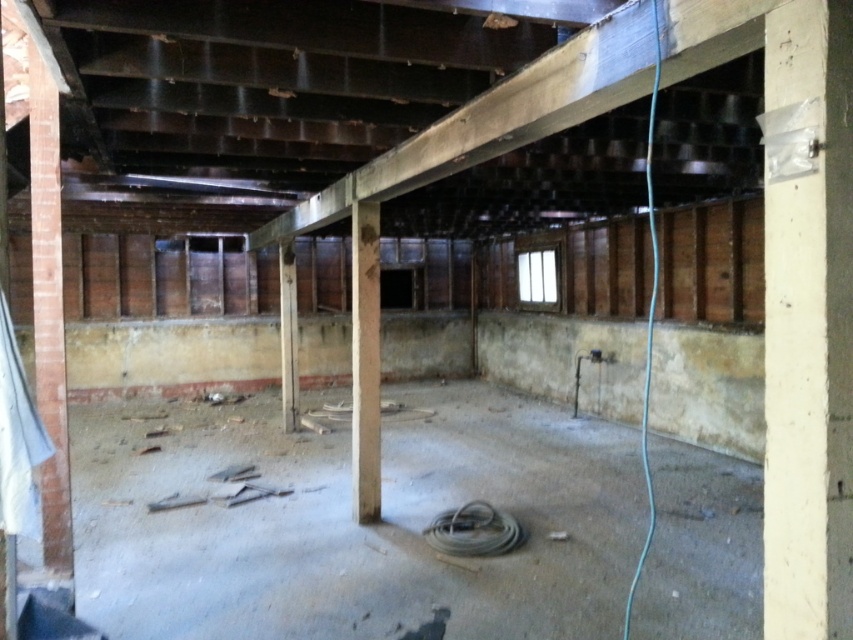
Question: Does white painted wood pillar at right appear on the left side of dark brown wooden beam at upper center?

Choices:
 (A) no
 (B) yes

Answer: (A)

Question: Which object appears farthest from the camera in this image?

Choices:
 (A) white painted wood pillar at right
 (B) dark brown wooden beam at upper center
 (C) concrete/rough pillar at center

Answer: (C)

Question: Is dark brown wooden beam at upper center to the left of concrete/rough pillar at center from the viewer's perspective?

Choices:
 (A) yes
 (B) no

Answer: (B)

Question: Does white painted wood pillar at right lie in front of concrete/rough pillar at center?

Choices:
 (A) no
 (B) yes

Answer: (B)

Question: Which point is closer to the camera?

Choices:
 (A) (577, 116)
 (B) (817, 547)

Answer: (B)

Question: Which of the following is the closest to the observer?

Choices:
 (A) (376, 516)
 (B) (740, 54)
 (C) (815, 58)

Answer: (C)